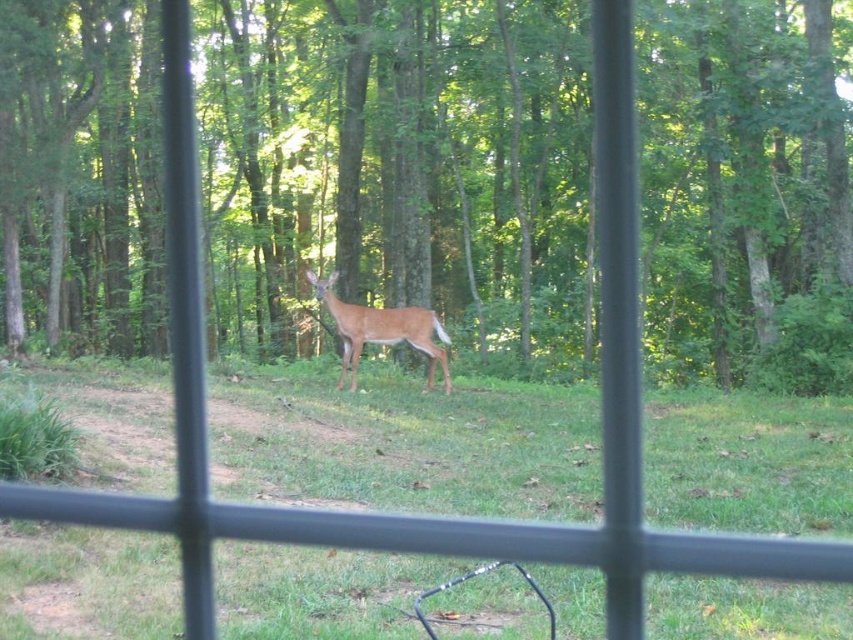
Question: In this image, where is green grassy at center located relative to brown fur deer at center?

Choices:
 (A) left
 (B) right

Answer: (B)

Question: Which point appears farthest from the camera in this image?

Choices:
 (A) (392, 314)
 (B) (375, 392)

Answer: (B)

Question: Is green grassy at center positioned before brown fur deer at center?

Choices:
 (A) yes
 (B) no

Answer: (A)

Question: Among these points, which one is farthest from the camera?

Choices:
 (A) [x=351, y=348]
 (B) [x=689, y=420]

Answer: (A)

Question: Does green grassy at center appear on the left side of brown fur deer at center?

Choices:
 (A) no
 (B) yes

Answer: (A)

Question: Among these points, which one is nearest to the camera?

Choices:
 (A) (103, 467)
 (B) (410, 340)

Answer: (A)